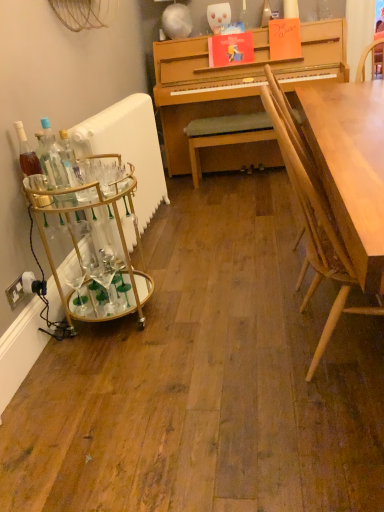
Question: Should I look upward or downward to see translucent glass bottle at left, the 2th bottle when ordered from right to left?

Choices:
 (A) down
 (B) up

Answer: (B)

Question: From the image's perspective, is white glossy radiator at left above gold metallic bar cart at left?

Choices:
 (A) no
 (B) yes

Answer: (B)

Question: Can you see white glossy radiator at left touching gold metallic bar cart at left?

Choices:
 (A) no
 (B) yes

Answer: (A)

Question: From a real-world perspective, is white glossy radiator at left physically below gold metallic bar cart at left?

Choices:
 (A) yes
 (B) no

Answer: (B)

Question: Does white glossy radiator at left have a greater height compared to gold metallic bar cart at left?

Choices:
 (A) yes
 (B) no

Answer: (A)

Question: Can you confirm if white glossy radiator at left is bigger than gold metallic bar cart at left?

Choices:
 (A) no
 (B) yes

Answer: (B)

Question: From the image's perspective, is white glossy radiator at left under gold metallic bar cart at left?

Choices:
 (A) no
 (B) yes

Answer: (A)

Question: From the image's perspective, is white glossy radiator at left over light brown wood chair at right?

Choices:
 (A) yes
 (B) no

Answer: (A)

Question: Considering the relative positions of white glossy radiator at left and light brown wood chair at right in the image provided, is white glossy radiator at left to the left of light brown wood chair at right from the viewer's perspective?

Choices:
 (A) yes
 (B) no

Answer: (A)

Question: Is white glossy radiator at left shorter than light brown wood chair at right?

Choices:
 (A) yes
 (B) no

Answer: (A)

Question: Is white glossy radiator at left surrounding light brown wood chair at right?

Choices:
 (A) yes
 (B) no

Answer: (B)

Question: From the image's perspective, is white glossy radiator at left located beneath light brown wood chair at right?

Choices:
 (A) yes
 (B) no

Answer: (B)

Question: Is white glossy radiator at left facing towards light brown wood chair at right?

Choices:
 (A) yes
 (B) no

Answer: (B)

Question: Would you say gold metallic bar cart at left is a long distance from white plastic power outlet at lower left?

Choices:
 (A) yes
 (B) no

Answer: (B)